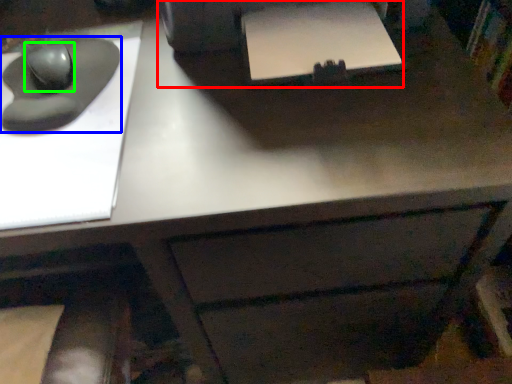
Question: Based on their relative distances, which object is farther from printer (highlighted by a red box)? Choose from mouse (highlighted by a blue box) and mouse (highlighted by a green box).

Choices:
 (A) mouse
 (B) mouse

Answer: (B)